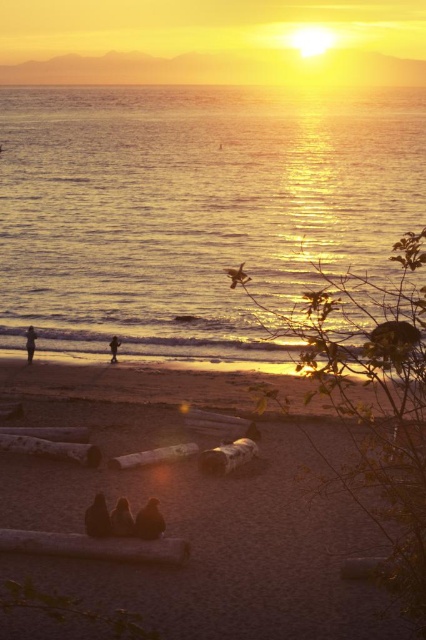
Is silhouette human at center bigger than silhouette figure at beach center?

Incorrect, silhouette human at center is not larger than silhouette figure at beach center.

Is silhouette human at center above silhouette figure at beach center?

Actually, silhouette human at center is below silhouette figure at beach center.

Who is more distant from viewer, (120, 518) or (115, 349)?

The point (115, 349) is behind.

At what (x,y) coordinates should I click in order to perform the action: click on silhouette human at center. Please return your answer as a coordinate pair (x, y). Looking at the image, I should click on (121, 518).

Is smooth sand at center below silhouette figure at lower left?

Yes.

From the picture: Which is below, smooth sand at center or silhouette figure at lower left?

smooth sand at center

Which is in front, point (111, 484) or point (34, 333)?

Point (111, 484) is more forward.

Find the location of a particular element. smooth sand at center is located at coordinates (199, 509).

Which is behind, point (308, 202) or point (132, 548)?

The point (308, 202) is behind.

Which is behind, point (55, 170) or point (48, 550)?

Point (55, 170)

Where is `golden reflective water at center`? This screenshot has width=426, height=640. golden reflective water at center is located at coordinates (193, 205).